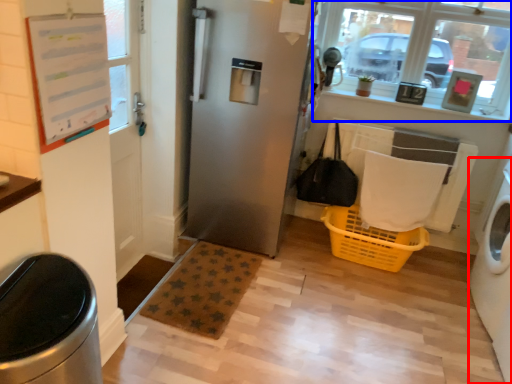
Question: Which point is further to the camera, washing machine (highlighted by a red box) or window (highlighted by a blue box)?

Choices:
 (A) washing machine
 (B) window

Answer: (B)